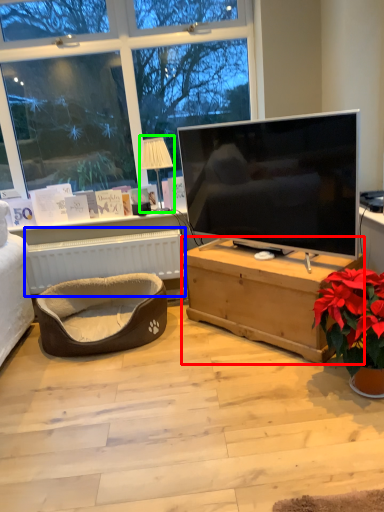
Question: Which object is the closest to the desk (highlighted by a red box)? Choose among these: radiator (highlighted by a blue box) or lamp (highlighted by a green box).

Choices:
 (A) radiator
 (B) lamp

Answer: (A)